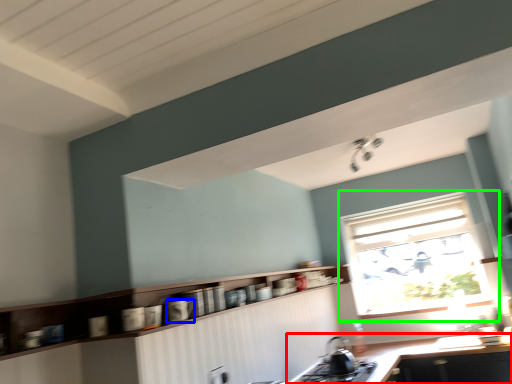
Question: Considering the real-world distances, which object is closest to countertop (highlighted by a red box)? appliance (highlighted by a blue box) or window (highlighted by a green box).

Choices:
 (A) appliance
 (B) window

Answer: (B)